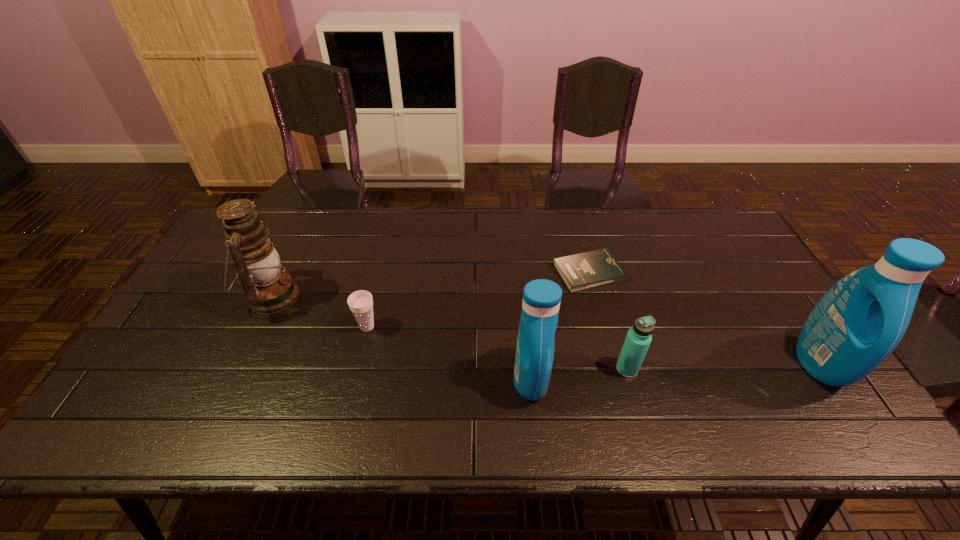
Considering the uniform spacing of detergents, where should an additional detergent be positioned on the left? Please locate a free spot. Please provide its 2D coordinates. Your answer should be formatted as a tuple, i.e. [(x, y)], where the tuple contains the x and y coordinates of a point satisfying the conditions above.

[(222, 397)]